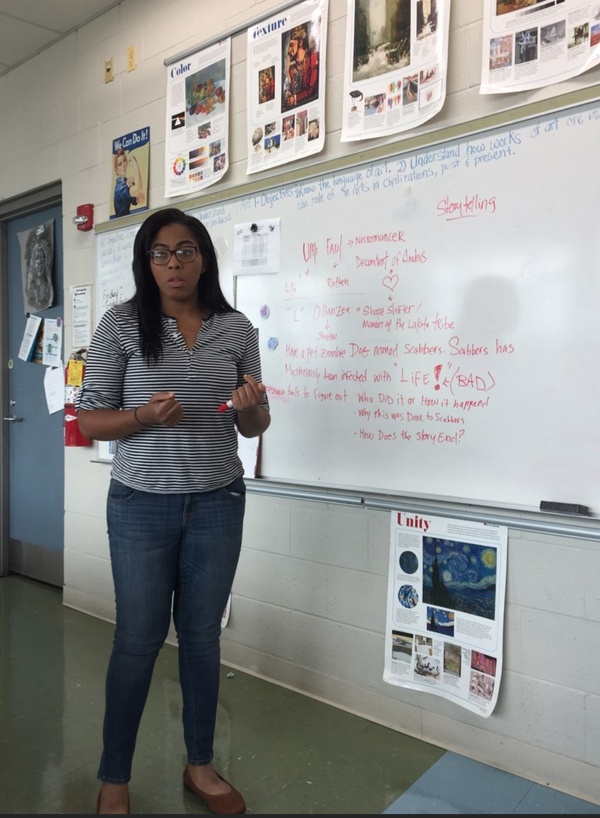
Find the location of `blue door`. blue door is located at coordinates (40, 414).